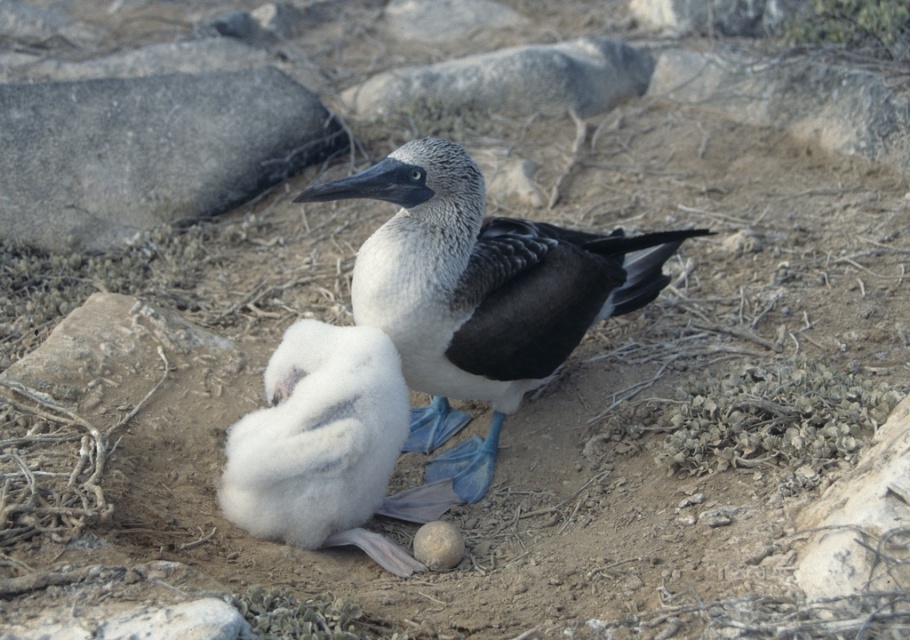
You are a wildlife photographer carrying a camera bag that requires 20 inches of space to set up. You want to place your equipment between the speckled feathered bird at center and the smooth gray stone at center. Is there enough space between them for your camera bag setup?

The distance between the speckled feathered bird at center and the smooth gray stone at center is 19.03 inches. Since your camera bag requires 20 inches of space, there isn t enough space between them for your setup.

You are a researcher studying Blue Footed Boobies and need to place a camera between the two points, point (282, 499) and point (828, 564). Which point should the camera be closer to in order to capture the bird in front?

The camera should be closer to point (828, 564) to capture the bird in front since point (282, 499) is behind point (828, 564).